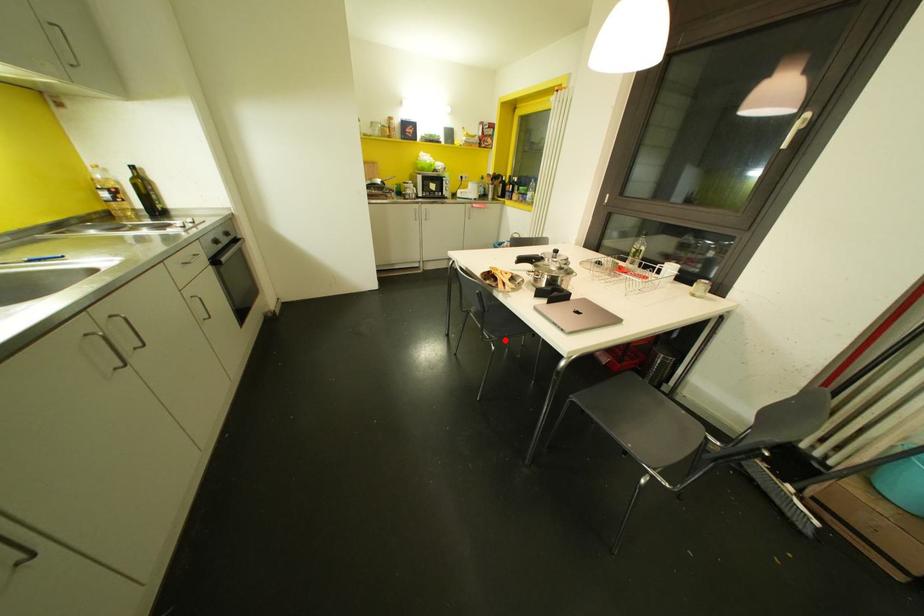
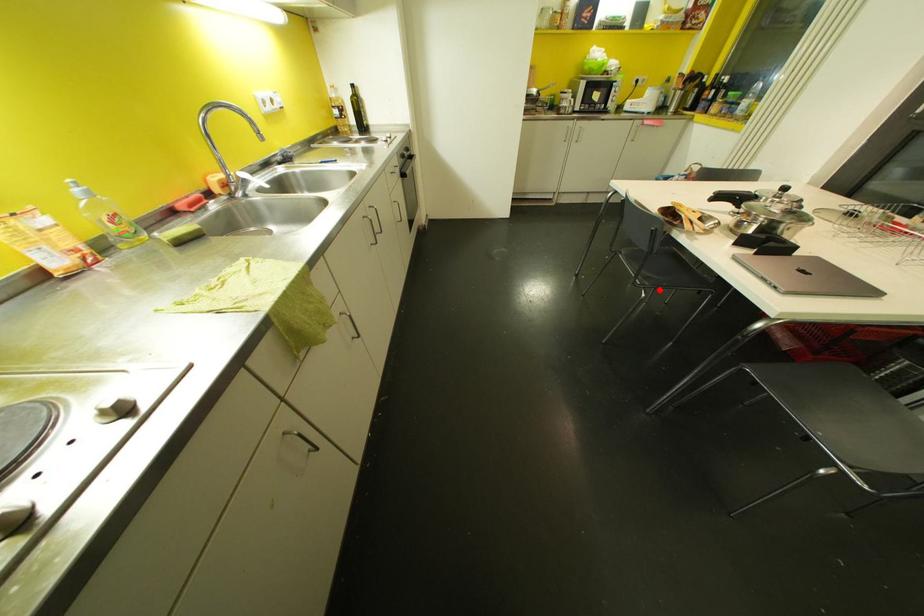
I am providing you with two images of the same scene from different viewpoints. A red point is marked on the first image and another point is marked on the second image. Does the point marked in image1 correspond to the same location as the one in image2?

Yes